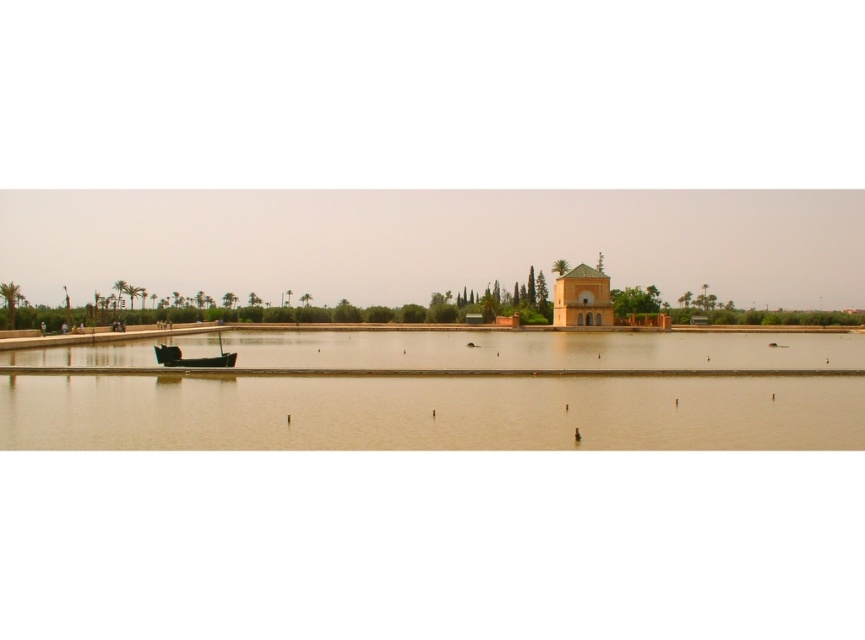
In the scene shown: Does golden stone palace at center have a smaller size compared to wooden boat at center?

Yes.

Which is in front, point (562, 301) or point (215, 358)?

Point (215, 358)

What do you see at coordinates (582, 298) in the screenshot? The height and width of the screenshot is (640, 865). I see `golden stone palace at center` at bounding box center [582, 298].

You are a GUI agent. You are given a task and a screenshot of the screen. Output one action in this format:
    pyautogui.click(x=<x>, y=<y>)
    Task: Click on the golden stone palace at center
    
    Given the screenshot: What is the action you would take?
    pyautogui.click(x=582, y=298)

Is brown matte water at center closer to camera compared to wooden boat at center?

Yes, brown matte water at center is in front of wooden boat at center.

Where is `brown matte water at center`? This screenshot has width=865, height=640. brown matte water at center is located at coordinates (431, 412).

Which is behind, point (761, 426) or point (225, 356)?

The point (225, 356) is behind.

The height and width of the screenshot is (640, 865). I want to click on brown matte water at center, so click(431, 412).

Who is lower down, brown matte water at center or golden stone palace at center?

brown matte water at center is below.

What do you see at coordinates (431, 412) in the screenshot?
I see `brown matte water at center` at bounding box center [431, 412].

Does point (396, 401) come in front of point (596, 305)?

Yes, it is in front of point (596, 305).

Where is `brown matte water at center`? The height and width of the screenshot is (640, 865). brown matte water at center is located at coordinates (431, 412).